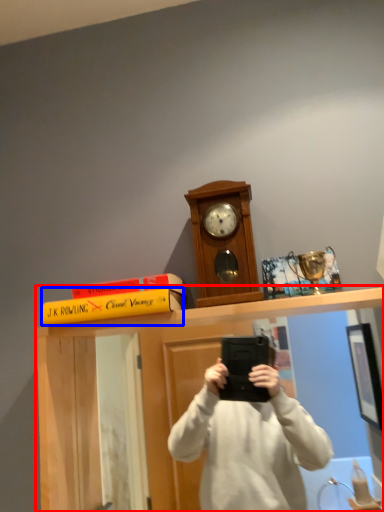
Question: Which point is closer to the camera, vanity (highlighted by a red box) or book (highlighted by a blue box)?

Choices:
 (A) vanity
 (B) book

Answer: (A)